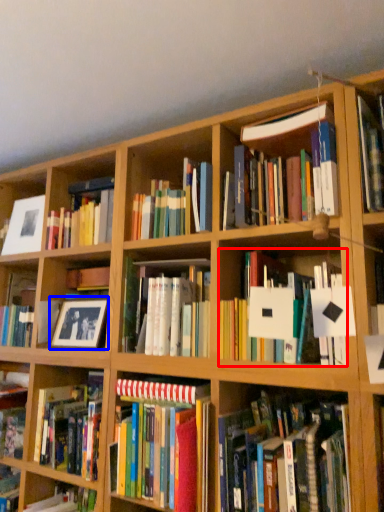
Question: Which object is closer to the camera taking this photo, book (highlighted by a red box) or picture frame (highlighted by a blue box)?

Choices:
 (A) book
 (B) picture frame

Answer: (A)